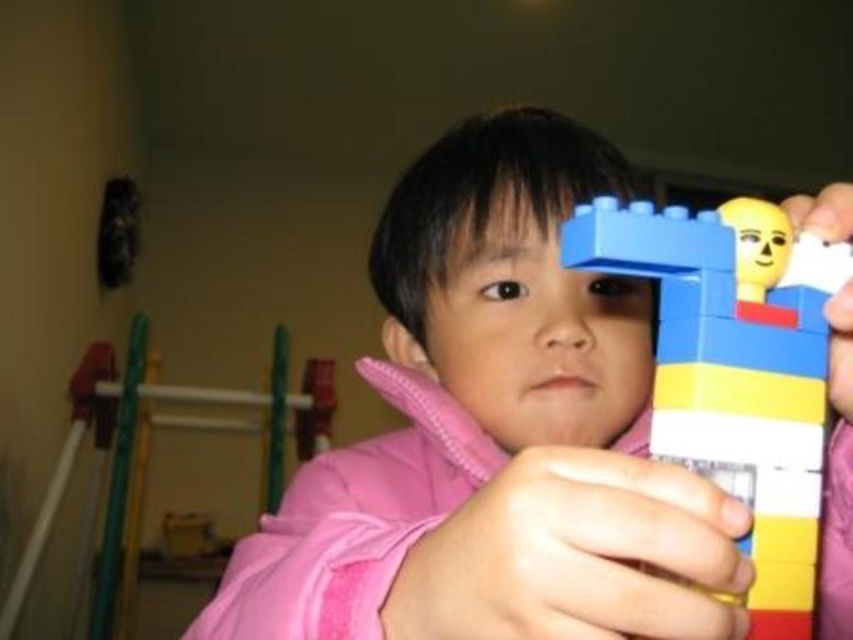
You are a photographer standing in the room. You want to take a photo of the matte plastic toy at center. According to the scene description, where should you position the camera to capture the toy in the frame?

The matte plastic toy at center is located at point coordinates [494,433], so you should position the camera to aim at that coordinate to capture it in the frame.